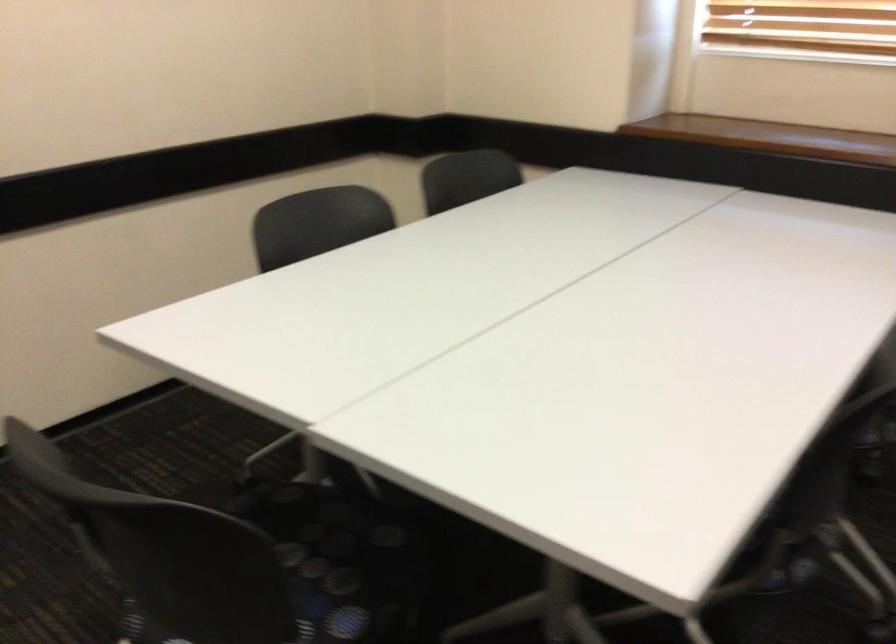
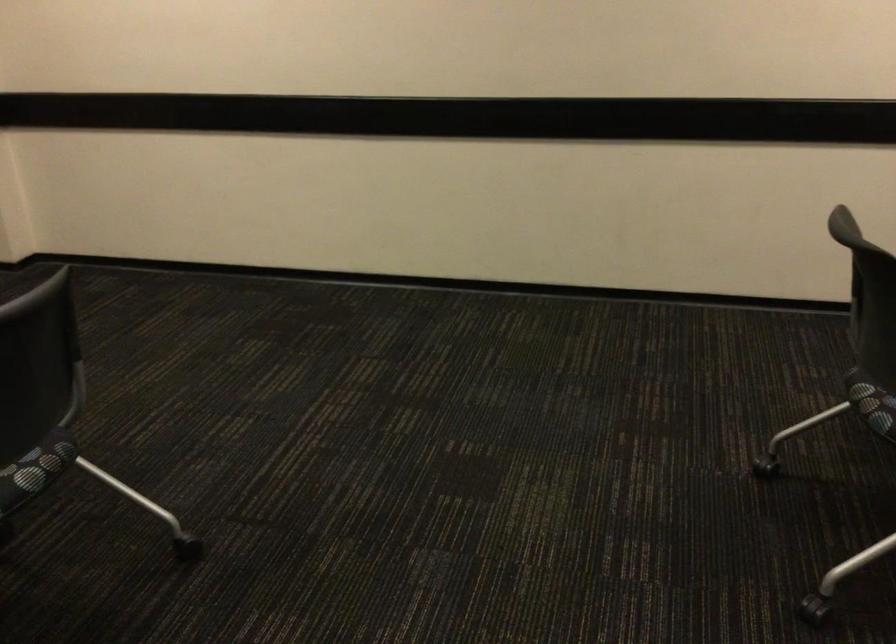
Question: Based on the continuous images, in which direction is the camera rotating? Reply with the corresponding letter.

Choices:
 (A) Left
 (B) Right
 (C) Up
 (D) Down

Answer: (A)